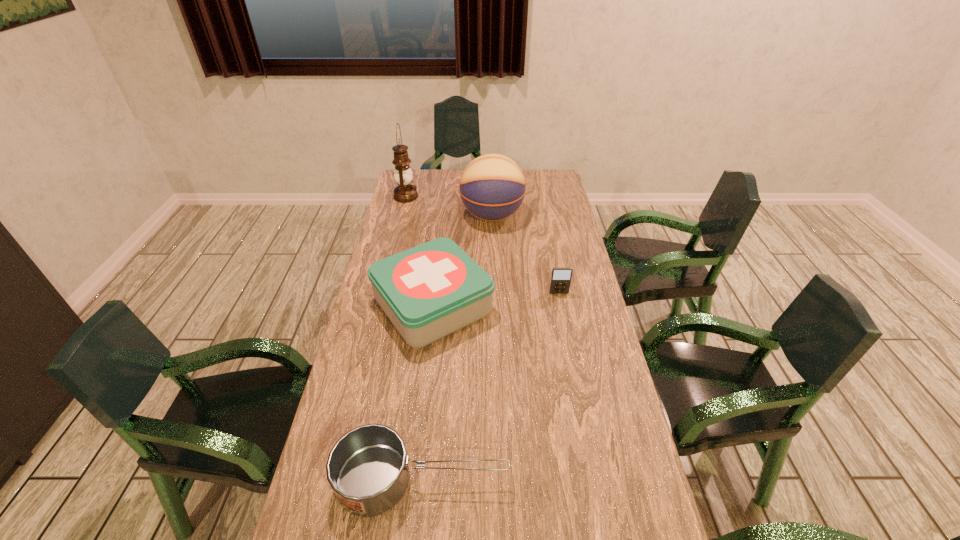
At what (x,y) coordinates should I click in order to perform the action: click on vacant space situated on the front-facing side of the rightmost object. Please return your answer as a coordinate pair (x, y). Image resolution: width=960 pixels, height=540 pixels. Looking at the image, I should click on (564, 319).

Where is `free space located 0.150m with the handle extending from one side of the saucepan`? free space located 0.150m with the handle extending from one side of the saucepan is located at coordinates (576, 480).

Locate an element on the screen. Image resolution: width=960 pixels, height=540 pixels. object located at the far edge is located at coordinates (405, 192).

Identify the location of oil lamp that is at the left edge. (405, 192).

You are a GUI agent. You are given a task and a screenshot of the screen. Output one action in this format:
    pyautogui.click(x=<x>, y=<y>)
    Task: Click on the first-aid kit that is at the left edge
    
    Given the screenshot: What is the action you would take?
    pyautogui.click(x=429, y=291)

The width and height of the screenshot is (960, 540). Find the location of `saucepan that is at the left edge`. saucepan that is at the left edge is located at coordinates (367, 468).

This screenshot has height=540, width=960. Find the location of `object located in the right edge section of the desktop`. object located in the right edge section of the desktop is located at coordinates (560, 282).

The width and height of the screenshot is (960, 540). Identify the location of object situated at the far left corner. (405, 192).

This screenshot has height=540, width=960. In order to click on vacant area at the left edge of the desktop in this screenshot , I will do `click(365, 377)`.

At what (x,y) coordinates should I click in order to perform the action: click on vacant space at the right edge of the desktop. Please return your answer as a coordinate pair (x, y). Looking at the image, I should click on (625, 425).